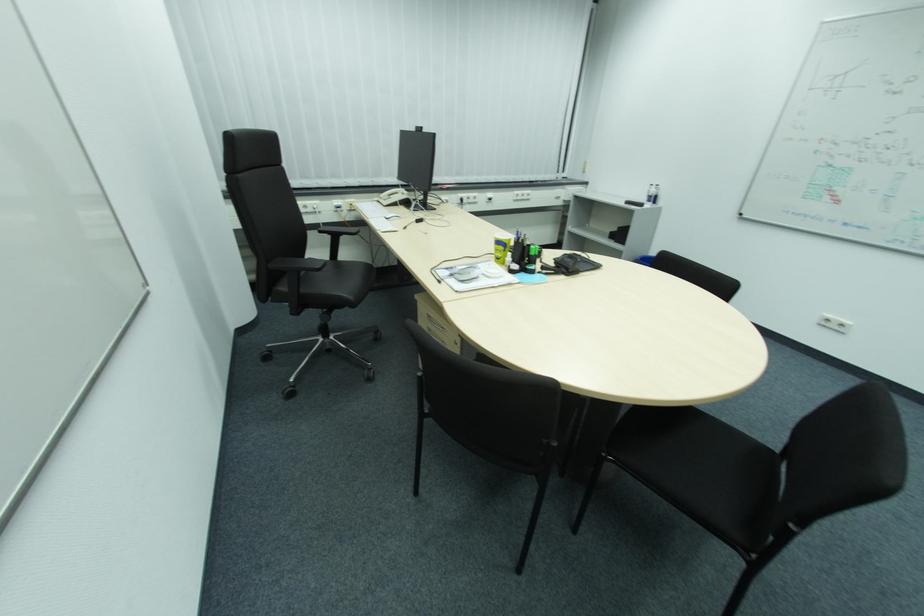
The width and height of the screenshot is (924, 616). Describe the element at coordinates (297, 265) in the screenshot. I see `a black chair armrest` at that location.